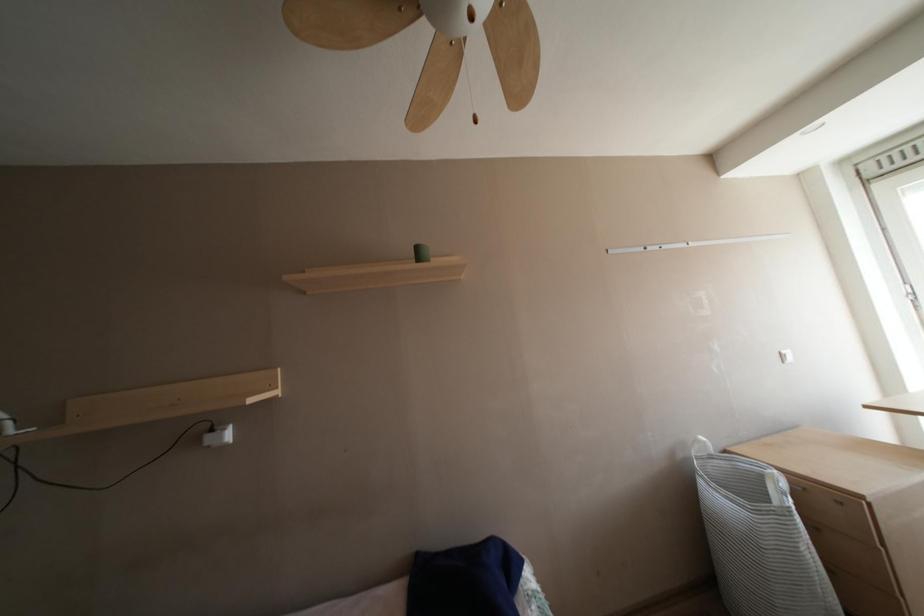
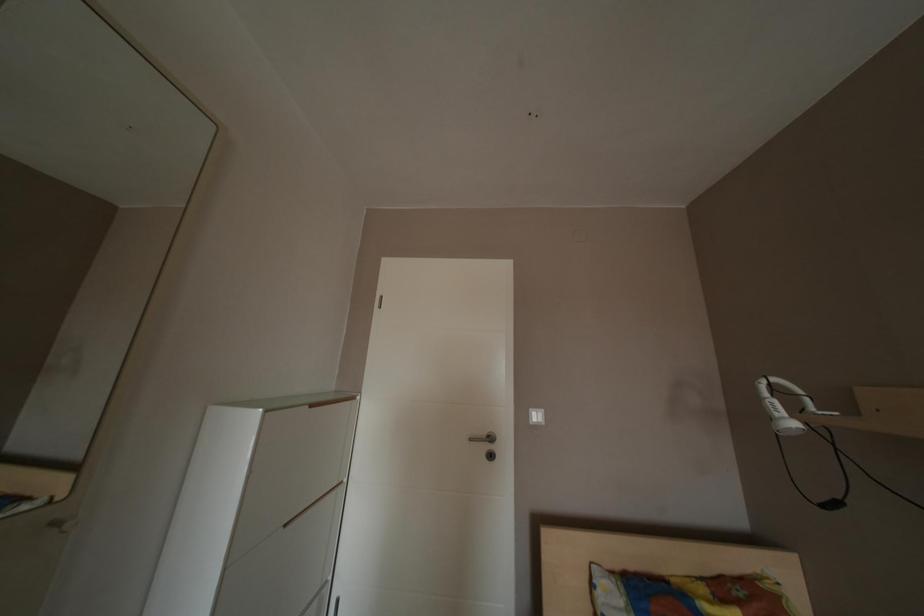
Question: Based on the continuous images, in which direction is the camera rotating? Reply with the corresponding letter.

Choices:
 (A) Left
 (B) Right
 (C) Up
 (D) Down

Answer: (A)